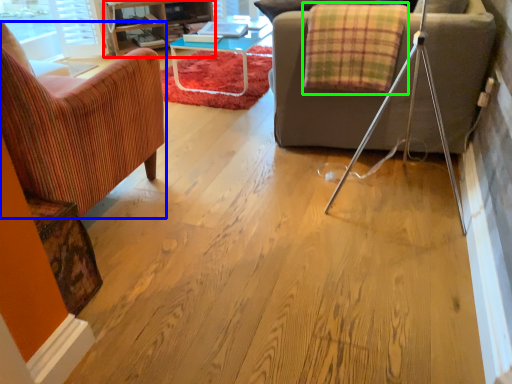
Question: Which is nearer to the entertainment center (highlighted by a red box)? chair (highlighted by a blue box) or blanket (highlighted by a green box).

Choices:
 (A) chair
 (B) blanket

Answer: (B)